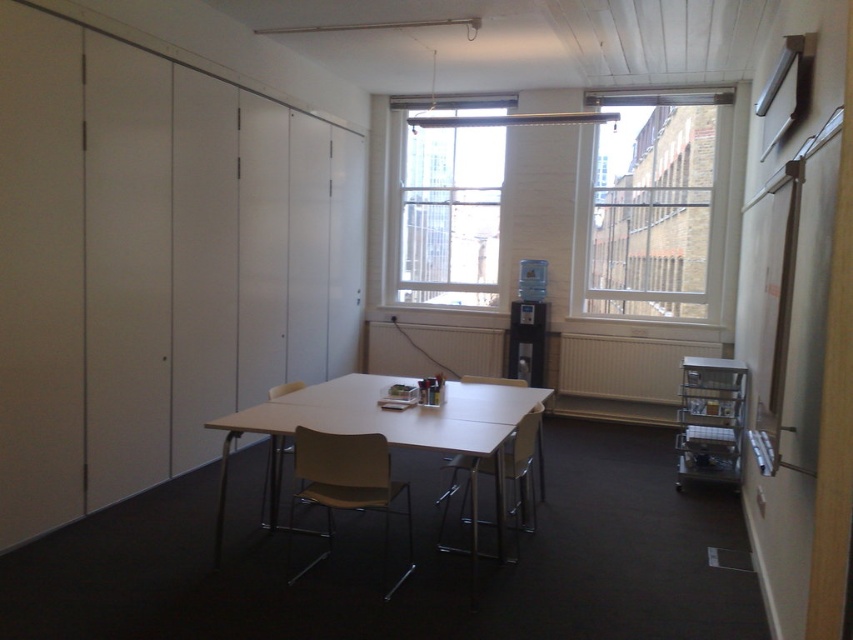
Measure the distance from clear glass window at center to light brown plastic chair at center.

clear glass window at center is 3.18 meters away from light brown plastic chair at center.

Describe the element at coordinates (447, 204) in the screenshot. The image size is (853, 640). I see `clear glass window at center` at that location.

Looking at this image, measure the distance between clear glass window at center and camera.

clear glass window at center is 22.82 feet away from camera.

This screenshot has height=640, width=853. In order to click on clear glass window at center in this screenshot , I will do `click(447, 204)`.

Is clear glass window at upper center to the left of clear glass window at center from the viewer's perspective?

Incorrect, clear glass window at upper center is not on the left side of clear glass window at center.

Does clear glass window at upper center have a greater width compared to clear glass window at center?

Yes.

This screenshot has width=853, height=640. Describe the element at coordinates (654, 208) in the screenshot. I see `clear glass window at upper center` at that location.

Image resolution: width=853 pixels, height=640 pixels. What are the coordinates of `clear glass window at upper center` in the screenshot? It's located at (654, 208).

Does beige plastic chair at center appear under light brown plastic chair at center?

No, beige plastic chair at center is not below light brown plastic chair at center.

Does beige plastic chair at center appear on the right side of light brown plastic chair at center?

No, beige plastic chair at center is not to the right of light brown plastic chair at center.

Is point (405, 515) farther from viewer compared to point (461, 472)?

No.

Image resolution: width=853 pixels, height=640 pixels. In order to click on beige plastic chair at center in this screenshot , I will do `click(347, 483)`.